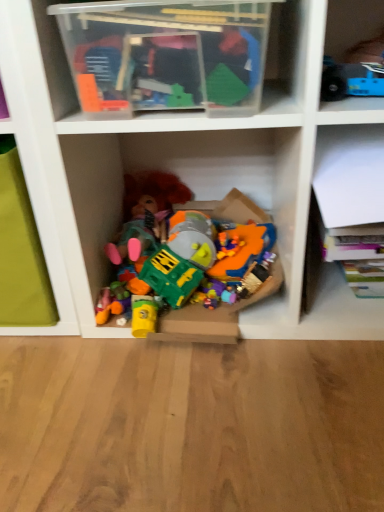
Image resolution: width=384 pixels, height=512 pixels. In order to click on white paper at upper right, the 2th shelf positioned from the left in this screenshot , I will do `click(341, 229)`.

Describe the element at coordinates (351, 80) in the screenshot. I see `blue plastic toy at upper right, marked as the 2th toy in a left-to-right arrangement` at that location.

Find the location of a particular element. blue plastic toy at upper right, the 1th toy in the right-to-left sequence is located at coordinates (351, 80).

What do you see at coordinates (214, 313) in the screenshot? This screenshot has height=512, width=384. I see `plastic toys at center, the 1th toy in the back-to-front sequence` at bounding box center [214, 313].

Image resolution: width=384 pixels, height=512 pixels. I want to click on plastic toys at center, which is the 2th toy from top to bottom, so click(214, 313).

Where is `white paper at upper right, arranged as the first shelf when ordered from the bottom`? The image size is (384, 512). white paper at upper right, arranged as the first shelf when ordered from the bottom is located at coordinates (341, 229).

Is white paper at upper right, the second shelf in the top-to-bottom sequence, looking in the opposite direction of plastic toys at center, the second toy when ordered from front to back?

No, white paper at upper right, the second shelf in the top-to-bottom sequence, is not facing away from plastic toys at center, the second toy when ordered from front to back.

Can plastic toys at center, which is the 1th toy in left-to-right order, be found inside white paper at upper right, which is the 1th shelf in right-to-left order?

Definitely not — plastic toys at center, which is the 1th toy in left-to-right order, is not inside white paper at upper right, which is the 1th shelf in right-to-left order.

Is white paper at upper right, the second shelf in the top-to-bottom sequence, wider or thinner than plastic toys at center, the first toy when ordered from bottom to top?

Clearly, white paper at upper right, the second shelf in the top-to-bottom sequence, has more width compared to plastic toys at center, the first toy when ordered from bottom to top.

Considering the relative positions of plastic toys at center, which is the 2th toy from top to bottom, and blue plastic toy at upper right, marked as the 2th toy in a left-to-right arrangement, in the image provided, is plastic toys at center, which is the 2th toy from top to bottom, in front of blue plastic toy at upper right, marked as the 2th toy in a left-to-right arrangement,?

No, it is behind blue plastic toy at upper right, marked as the 2th toy in a left-to-right arrangement.

Looking at this image, from a real-world perspective, is plastic toys at center, which is the 1th toy in left-to-right order, physically below blue plastic toy at upper right, the 1th toy in the right-to-left sequence?

Yes, from a real-world perspective, plastic toys at center, which is the 1th toy in left-to-right order, is under blue plastic toy at upper right, the 1th toy in the right-to-left sequence.

Between point (216, 310) and point (322, 85), which one is positioned behind?

The point (216, 310) is farther from the camera.

In the image, is plastic toys at center, which is the 2th toy from top to bottom, on the left side or the right side of blue plastic toy at upper right, the 1th toy from the front?

Clearly, plastic toys at center, which is the 2th toy from top to bottom, is on the left of blue plastic toy at upper right, the 1th toy from the front, in the image.

From a real-world perspective, does plastic toys at center, the second toy when ordered from front to back, stand above white paper at upper right, which is the 1th shelf in right-to-left order?

No, from a real-world perspective, plastic toys at center, the second toy when ordered from front to back, is not above white paper at upper right, which is the 1th shelf in right-to-left order.

Locate an element on the screen. The height and width of the screenshot is (512, 384). the 1st shelf in front of the plastic toys at center, the second toy when ordered from front to back, starting your count from the anchor is located at coordinates (341, 229).

Is plastic toys at center, the 1th toy in the back-to-front sequence, next to white paper at upper right, the 2th shelf positioned from the left, and touching it?

plastic toys at center, the 1th toy in the back-to-front sequence, and white paper at upper right, the 2th shelf positioned from the left, are not in contact.

Between point (256, 287) and point (307, 287), which one is positioned in front?

The point (256, 287) is in front.

Is plastic toys at center, the 1th toy in the back-to-front sequence, inside the boundaries of transparent plastic container at upper center, marked as the first shelf in a left-to-right arrangement, or outside?

plastic toys at center, the 1th toy in the back-to-front sequence, exists outside the volume of transparent plastic container at upper center, marked as the first shelf in a left-to-right arrangement.

Looking at this image, considering the relative sizes of plastic toys at center, acting as the second toy starting from the right, and transparent plastic container at upper center, which appears as the 1th shelf when viewed from the top, in the image provided, is plastic toys at center, acting as the second toy starting from the right, wider than transparent plastic container at upper center, which appears as the 1th shelf when viewed from the top,?

Yes, plastic toys at center, acting as the second toy starting from the right, is wider than transparent plastic container at upper center, which appears as the 1th shelf when viewed from the top.

In the scene shown: From a real-world perspective, between plastic toys at center, which is the 1th toy in left-to-right order, and transparent plastic container at upper center, the second shelf from the right, who is vertically lower?

plastic toys at center, which is the 1th toy in left-to-right order, from a real-world perspective.

From a real-world perspective, which toy is the 2nd one underneath the transparent plastic container at upper center, marked as the first shelf in a left-to-right arrangement? Please provide its 2D coordinates.

[(214, 313)]

You are a GUI agent. You are given a task and a screenshot of the screen. Output one action in this format:
    pyautogui.click(x=<x>, y=<y>)
    Task: Click on the shelf lying on the left of blue plastic toy at upper right, the 1th toy from the front
    This screenshot has height=512, width=384.
    Given the screenshot: What is the action you would take?
    pyautogui.click(x=192, y=54)

Can you confirm if blue plastic toy at upper right, which appears as the second toy when viewed from the back, is taller than transparent plastic container at upper center, marked as the first shelf in a left-to-right arrangement?

No.

Is blue plastic toy at upper right, which appears as the second toy when viewed from the back, facing towards transparent plastic container at upper center, the second shelf from the right?

No, blue plastic toy at upper right, which appears as the second toy when viewed from the back, is not oriented towards transparent plastic container at upper center, the second shelf from the right.

From the image's perspective, is blue plastic toy at upper right, marked as the 2th toy in a left-to-right arrangement, on transparent plastic container at upper center, which appears as the 1th shelf when viewed from the top?

No.

Measure the distance from transparent plastic container at upper center, the second shelf from the bottom, to white paper at upper right, the 2th shelf positioned from the left.

transparent plastic container at upper center, the second shelf from the bottom, is 10.24 inches away from white paper at upper right, the 2th shelf positioned from the left.

Is transparent plastic container at upper center, the second shelf from the right, in front of or behind white paper at upper right, the second shelf in the top-to-bottom sequence, in the image?

Clearly, transparent plastic container at upper center, the second shelf from the right, is in front of white paper at upper right, the second shelf in the top-to-bottom sequence.

Is white paper at upper right, the second shelf in the top-to-bottom sequence, at the back of transparent plastic container at upper center, the second shelf from the bottom?

No, transparent plastic container at upper center, the second shelf from the bottom, is not facing the opposite direction of white paper at upper right, the second shelf in the top-to-bottom sequence.

Considering their positions, is white paper at upper right, the second shelf in the top-to-bottom sequence, located in front of or behind transparent plastic container at upper center, the second shelf from the right?

white paper at upper right, the second shelf in the top-to-bottom sequence, is positioned farther from the viewer than transparent plastic container at upper center, the second shelf from the right.

Which of these two, white paper at upper right, which is the 1th shelf in right-to-left order, or transparent plastic container at upper center, the second shelf from the bottom, is smaller?

transparent plastic container at upper center, the second shelf from the bottom.

Can you tell me how much white paper at upper right, the 2th shelf positioned from the left, and transparent plastic container at upper center, the second shelf from the bottom, differ in facing direction?

white paper at upper right, the 2th shelf positioned from the left, and transparent plastic container at upper center, the second shelf from the bottom, are facing 0.104 degrees away from each other.

Which is more to the right, white paper at upper right, the second shelf in the top-to-bottom sequence, or transparent plastic container at upper center, the second shelf from the bottom?

Positioned to the right is white paper at upper right, the second shelf in the top-to-bottom sequence.

From the image's perspective, starting from the plastic toys at center, acting as the second toy starting from the right, which shelf is the 1st one above? Please provide its 2D coordinates.

[(341, 229)]

Locate an element on the screen. The height and width of the screenshot is (512, 384). toy on the right side of plastic toys at center, acting as the second toy starting from the right is located at coordinates (351, 80).

From the image, which object appears to be nearer to plastic toys at center, the first toy when ordered from bottom to top, white paper at upper right, the second shelf in the top-to-bottom sequence, or blue plastic toy at upper right, marked as the 2th toy in a left-to-right arrangement?

Among the two, white paper at upper right, the second shelf in the top-to-bottom sequence, is located nearer to plastic toys at center, the first toy when ordered from bottom to top.

Estimate the real-world distances between objects in this image. Which object is further from plastic toys at center, which is the 2th toy from top to bottom, blue plastic toy at upper right, the first toy from the top, or white paper at upper right, the 2th shelf positioned from the left?

blue plastic toy at upper right, the first toy from the top, is positioned further to the anchor plastic toys at center, which is the 2th toy from top to bottom.

Which object lies nearer to the anchor point white paper at upper right, arranged as the first shelf when ordered from the bottom, blue plastic toy at upper right, marked as the 2th toy in a left-to-right arrangement, or plastic toys at center, acting as the second toy starting from the right?

plastic toys at center, acting as the second toy starting from the right.

Based on their spatial positions, is white paper at upper right, which is the 1th shelf in right-to-left order, or plastic toys at center, the first toy when ordered from bottom to top, further from transparent plastic container at upper center, the second shelf from the right?

Based on the image, plastic toys at center, the first toy when ordered from bottom to top, appears to be further to transparent plastic container at upper center, the second shelf from the right.

From the image, which object appears to be farther from blue plastic toy at upper right, the 1th toy in the right-to-left sequence, transparent plastic container at upper center, the second shelf from the bottom, or plastic toys at center, the second toy when ordered from front to back?

Among the two, plastic toys at center, the second toy when ordered from front to back, is located further to blue plastic toy at upper right, the 1th toy in the right-to-left sequence.

Estimate the real-world distances between objects in this image. Which object is closer to white paper at upper right, which is the 1th shelf in right-to-left order, transparent plastic container at upper center, the second shelf from the right, or plastic toys at center, the 1th toy in the back-to-front sequence?

Answer: plastic toys at center, the 1th toy in the back-to-front sequence, lies closer to white paper at upper right, which is the 1th shelf in right-to-left order, than the other object.

Looking at the image, which one is located further to white paper at upper right, which is the 1th shelf in right-to-left order, plastic toys at center, which is the 1th toy in left-to-right order, or blue plastic toy at upper right, marked as the 2th toy in a left-to-right arrangement?

Among the two, blue plastic toy at upper right, marked as the 2th toy in a left-to-right arrangement, is located further to white paper at upper right, which is the 1th shelf in right-to-left order.

Estimate the real-world distances between objects in this image. Which object is further from plastic toys at center, which is the 2th toy from top to bottom, transparent plastic container at upper center, the second shelf from the right, or blue plastic toy at upper right, marked as the 2th toy in a left-to-right arrangement?

Based on the image, blue plastic toy at upper right, marked as the 2th toy in a left-to-right arrangement, appears to be further to plastic toys at center, which is the 2th toy from top to bottom.

Image resolution: width=384 pixels, height=512 pixels. What are the coordinates of `toy between plastic toys at center, the 1th toy in the back-to-front sequence, and white paper at upper right, the 2th shelf positioned from the left, from left to right` in the screenshot? It's located at (351, 80).

At what (x,y) coordinates should I click in order to perform the action: click on toy between transparent plastic container at upper center, which appears as the 1th shelf when viewed from the top, and blue plastic toy at upper right, the second toy when ordered from bottom to top, in the horizontal direction. Please return your answer as a coordinate pair (x, y). This screenshot has height=512, width=384. Looking at the image, I should click on (214, 313).